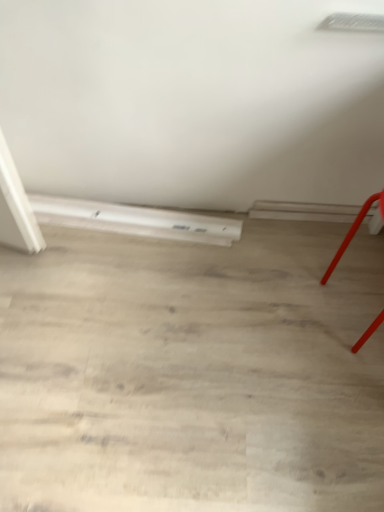
Question: Is white matte heater at lower left not near smooth red chair at right?

Choices:
 (A) no
 (B) yes

Answer: (A)

Question: Does white matte heater at lower left have a greater width compared to smooth red chair at right?

Choices:
 (A) no
 (B) yes

Answer: (A)

Question: Is smooth red chair at right at the back of white matte heater at lower left?

Choices:
 (A) yes
 (B) no

Answer: (B)

Question: Can you confirm if white matte heater at lower left is thinner than smooth red chair at right?

Choices:
 (A) yes
 (B) no

Answer: (A)

Question: From a real-world perspective, does white matte heater at lower left sit lower than smooth red chair at right?

Choices:
 (A) no
 (B) yes

Answer: (B)

Question: Is white matte heater at lower left smaller than smooth red chair at right?

Choices:
 (A) no
 (B) yes

Answer: (B)

Question: Does smooth red chair at right have a smaller size compared to white matte heater at lower left?

Choices:
 (A) no
 (B) yes

Answer: (A)

Question: From the image's perspective, is smooth red chair at right below white matte heater at lower left?

Choices:
 (A) no
 (B) yes

Answer: (B)

Question: From a real-world perspective, is smooth red chair at right under white matte heater at lower left?

Choices:
 (A) no
 (B) yes

Answer: (A)

Question: Are smooth red chair at right and white matte heater at lower left making contact?

Choices:
 (A) yes
 (B) no

Answer: (B)

Question: From the image's perspective, does smooth red chair at right appear higher than white matte heater at lower left?

Choices:
 (A) yes
 (B) no

Answer: (B)

Question: Does smooth red chair at right turn towards white matte heater at lower left?

Choices:
 (A) yes
 (B) no

Answer: (B)

Question: Is smooth red chair at right spatially inside white matte heater at lower left, or outside of it?

Choices:
 (A) inside
 (B) outside

Answer: (B)